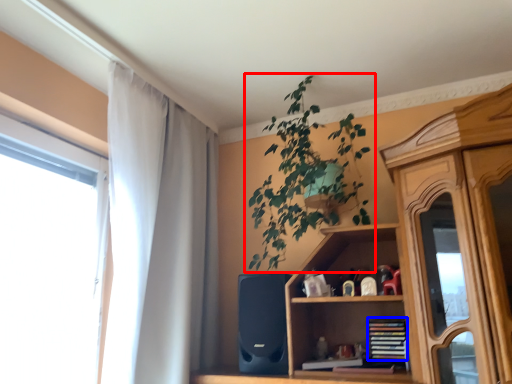
Question: Among these objects, which one is nearest to the camera, houseplant (highlighted by a red box) or book (highlighted by a blue box)?

Choices:
 (A) houseplant
 (B) book

Answer: (A)